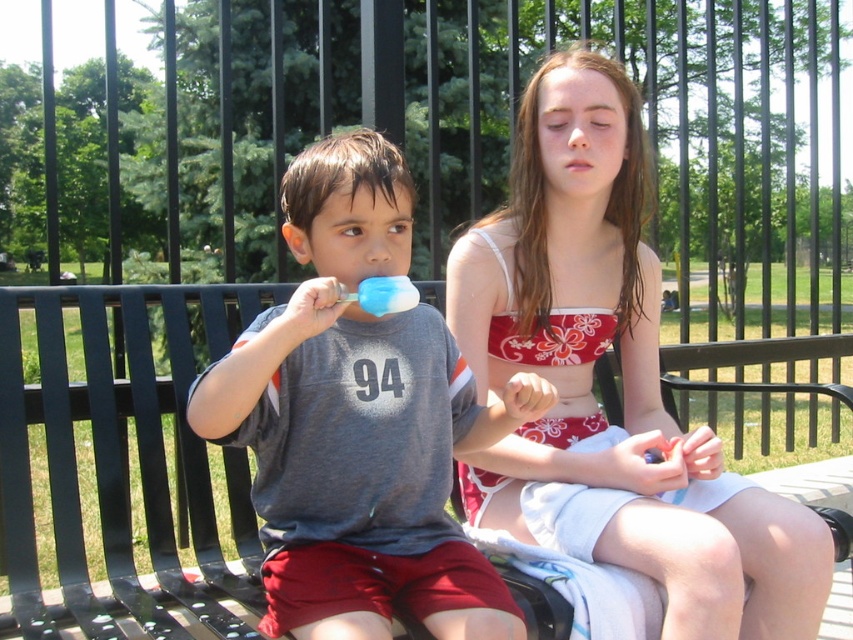
Does red floral tank top at center have a smaller size compared to metallic black bench at center?

No, red floral tank top at center is not smaller than metallic black bench at center.

Is red floral tank top at center positioned in front of metallic black bench at center?

No, it is not.

Where is `red floral tank top at center`? Image resolution: width=853 pixels, height=640 pixels. red floral tank top at center is located at coordinates (621, 378).

Between matte gray t-shirt at center and metallic black bench at center, which one has more height?

Standing taller between the two is matte gray t-shirt at center.

Can you confirm if matte gray t-shirt at center is positioned to the left of metallic black bench at center?

No, matte gray t-shirt at center is not to the left of metallic black bench at center.

Image resolution: width=853 pixels, height=640 pixels. What do you see at coordinates (358, 420) in the screenshot? I see `matte gray t-shirt at center` at bounding box center [358, 420].

You are a GUI agent. You are given a task and a screenshot of the screen. Output one action in this format:
    pyautogui.click(x=<x>, y=<y>)
    Task: Click on the matte gray t-shirt at center
    Image resolution: width=853 pixels, height=640 pixels.
    Given the screenshot: What is the action you would take?
    pyautogui.click(x=358, y=420)

Is point (634, 509) in front of point (320, 385)?

No.

Based on the photo, who is more distant from viewer, (750, 563) or (224, 384)?

The point (750, 563) is more distant.

Image resolution: width=853 pixels, height=640 pixels. Identify the location of red floral tank top at center. (621, 378).